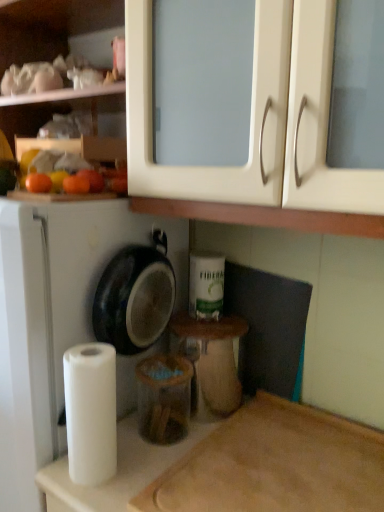
Question: Is matte plastic container at center taller or shorter than white matte dish washer at left?

Choices:
 (A) tall
 (B) short

Answer: (B)

Question: From a real-world perspective, is matte plastic container at center above or below white matte dish washer at left?

Choices:
 (A) below
 (B) above

Answer: (B)

Question: Which is nearer to the white matte paper towel at lower left?

Choices:
 (A) matte plastic container at center
 (B) wooden cutting board at lower right
 (C) white matte dish washer at left
 (D) orange matte at left, positioned as the second orange in right-to-left order
 (E) white matte toilet paper at center

Answer: (C)

Question: Estimate the real-world distances between objects in this image. Which object is closer to the wooden cutting board at lower right?

Choices:
 (A) orange matte at left, positioned as the second orange in right-to-left order
 (B) white matte toilet paper at center
 (C) white matte paper towel at lower left
 (D) matte white cabinet at upper center
 (E) white matte dish washer at left

Answer: (C)